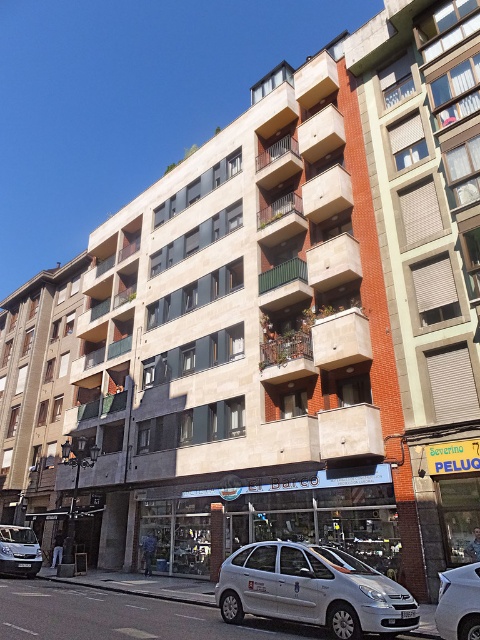
You are standing at the entrance of the residential building and want to park your car at the exact position where the white matte car at lower center is currently parked. According to the building layout, what are the coordinates of the parking spot you should aim for?

The coordinates of the parking spot where the white matte car at lower center is parked are at point (312,589).

You are a pedestrian standing on the sidewalk in front of the residential building. You see a silver metallic car at center and a silver metallic van at lower left. Which one is closer to you?

The silver metallic car at center is closer to you because it is in front of the silver metallic van at lower left.